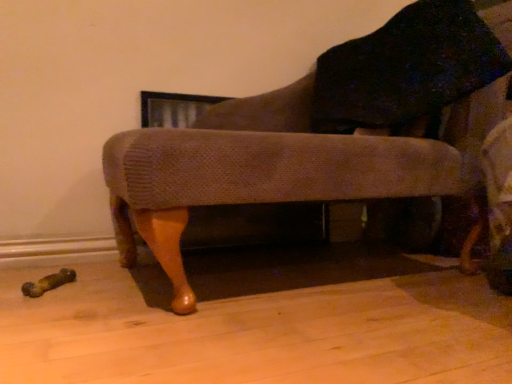
Where is `vacant area situated below knitted fabric ottoman at center (from a real-world perspective)`? The width and height of the screenshot is (512, 384). vacant area situated below knitted fabric ottoman at center (from a real-world perspective) is located at coordinates (281, 273).